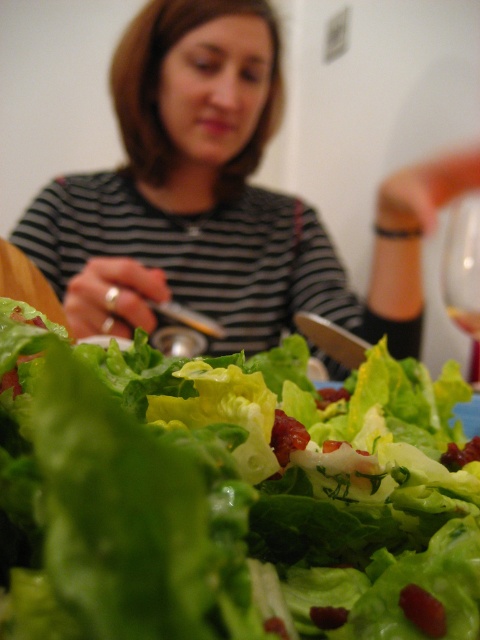
Question: Is striped fabric shirt at upper center above transparent glass at upper right?

Choices:
 (A) no
 (B) yes

Answer: (B)

Question: Which is nearer to the striped fabric shirt at upper center?

Choices:
 (A) translucent glass wine at center
 (B) green leafy lettuce at center
 (C) transparent glass at upper right

Answer: (C)

Question: Can you confirm if green leafy lettuce at center is bigger than transparent glass at upper right?

Choices:
 (A) no
 (B) yes

Answer: (A)

Question: Which of the following is the farthest from the observer?

Choices:
 (A) green leafy lettuce at center
 (B) translucent glass wine at center
 (C) transparent glass at upper right

Answer: (B)

Question: Among these points, which one is nearest to the camera?

Choices:
 (A) (57, 259)
 (B) (460, 326)
 (C) (208, 474)
 (D) (463, 305)

Answer: (C)

Question: Considering the relative positions of green leafy lettuce at center and translucent glass wine at center in the image provided, where is green leafy lettuce at center located with respect to translucent glass wine at center?

Choices:
 (A) below
 (B) above

Answer: (A)